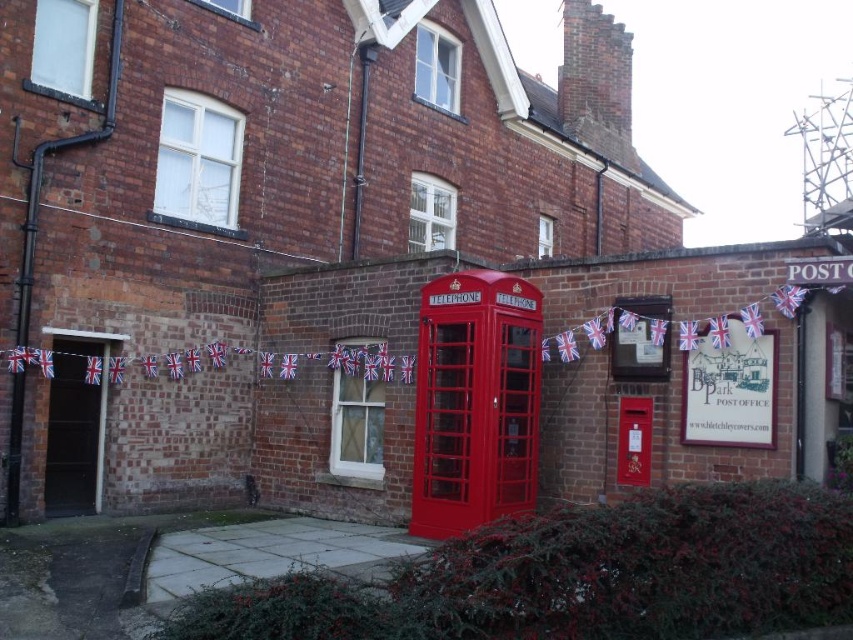
In the scene shown: Is matte red telephone box at center shorter than metallic red telephone box at center?

No, matte red telephone box at center is not shorter than metallic red telephone box at center.

Does matte red telephone box at center appear on the right side of metallic red telephone box at center?

In fact, matte red telephone box at center is to the left of metallic red telephone box at center.

Is point (485, 285) in front of point (634, 476)?

Yes, point (485, 285) is closer to viewer.

In order to click on matte red telephone box at center in this screenshot , I will do `click(474, 401)`.